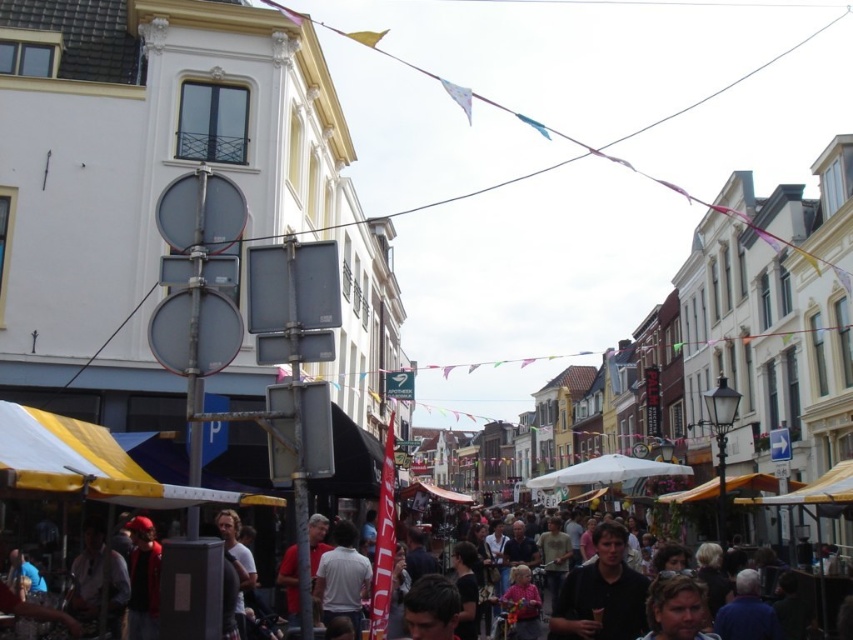
You are standing at the entrance of the street and see a person wearing a dark brown shirt at center. Where exactly is this person positioned relative to your current location?

The dark brown shirt at center is located at point (601,593), which means the person is positioned approximately 93 percent to the right and 71 percent down from your current viewpoint.